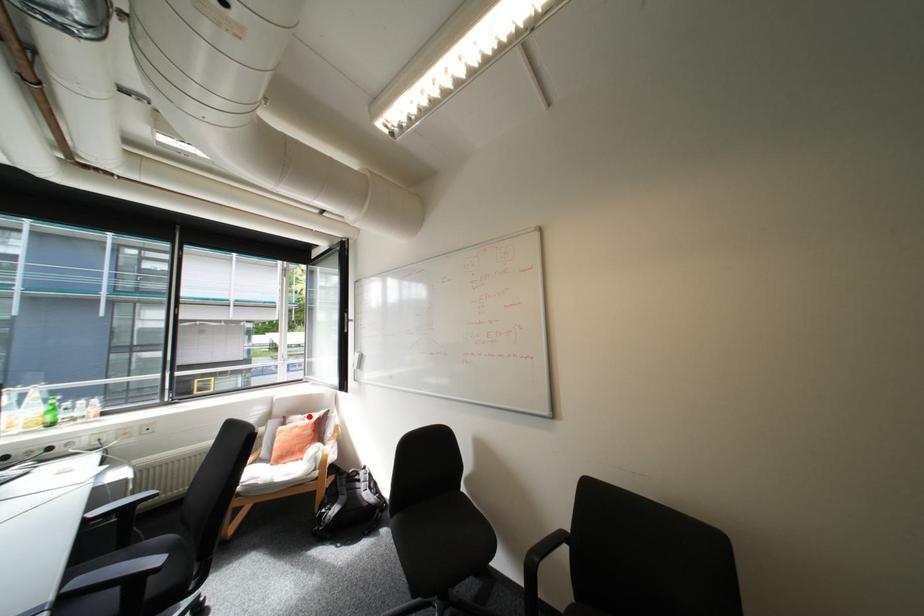
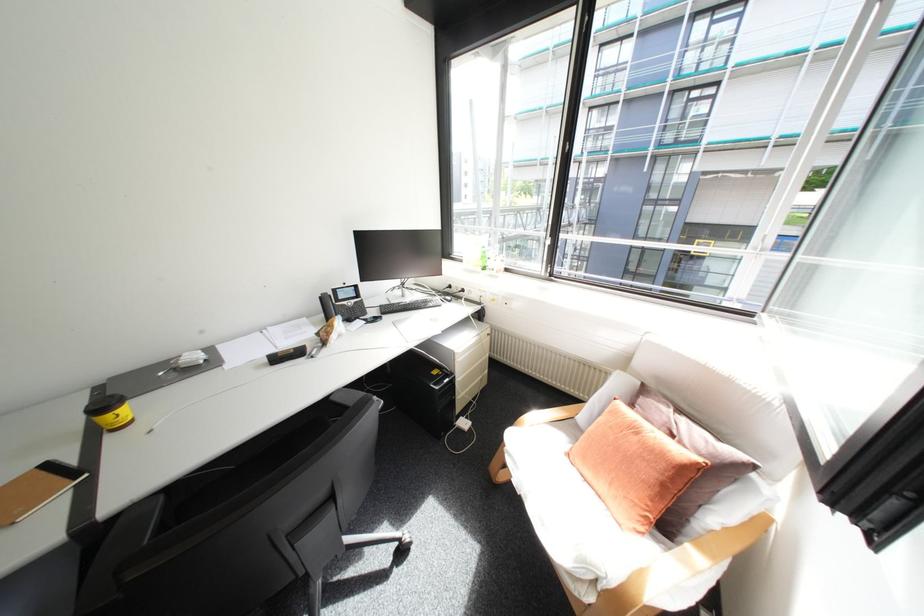
Question: I am providing you with two images of the same scene from different viewpoints. Image1 has a red point marked. In image2, the corresponding 3D location appears at what relative position? Reply with the corresponding letter.

Choices:
 (A) Closer
 (B) Farther

Answer: (A)